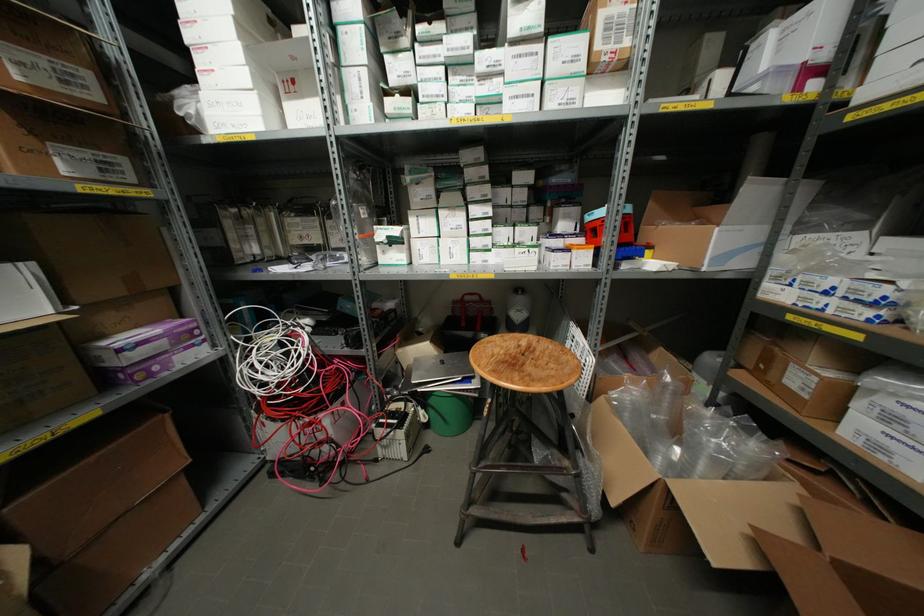
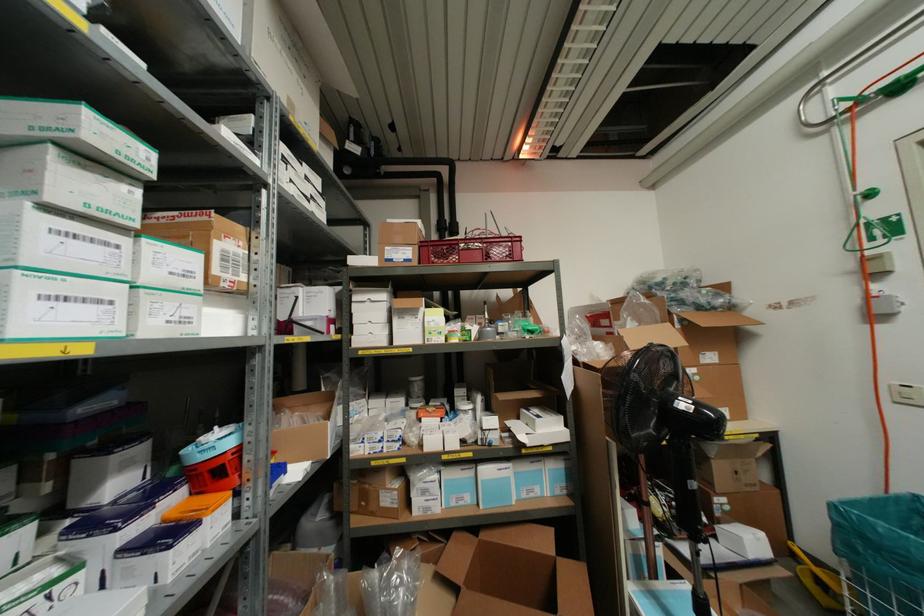
Find the pixel in the second image that matches (x=569, y=100) in the first image.

(185, 320)